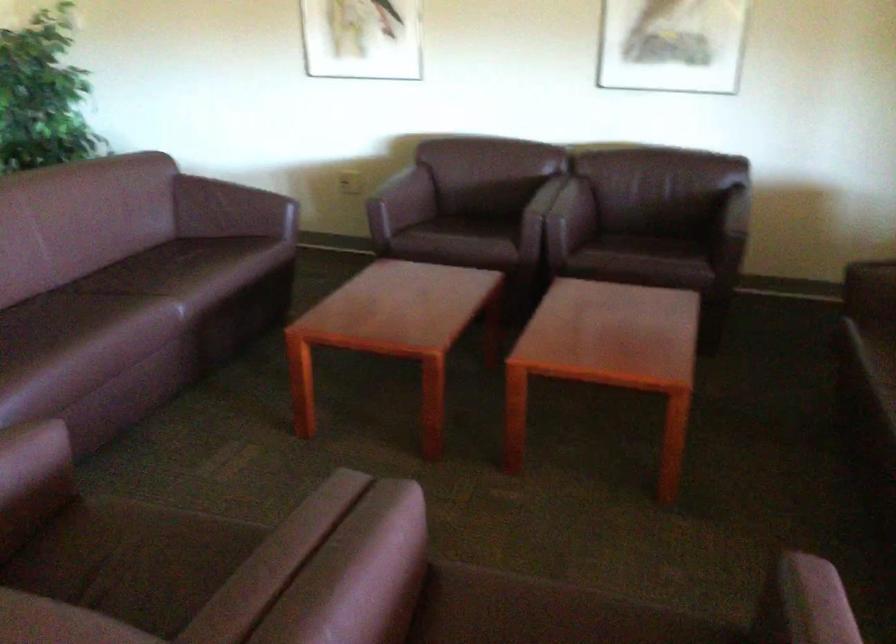
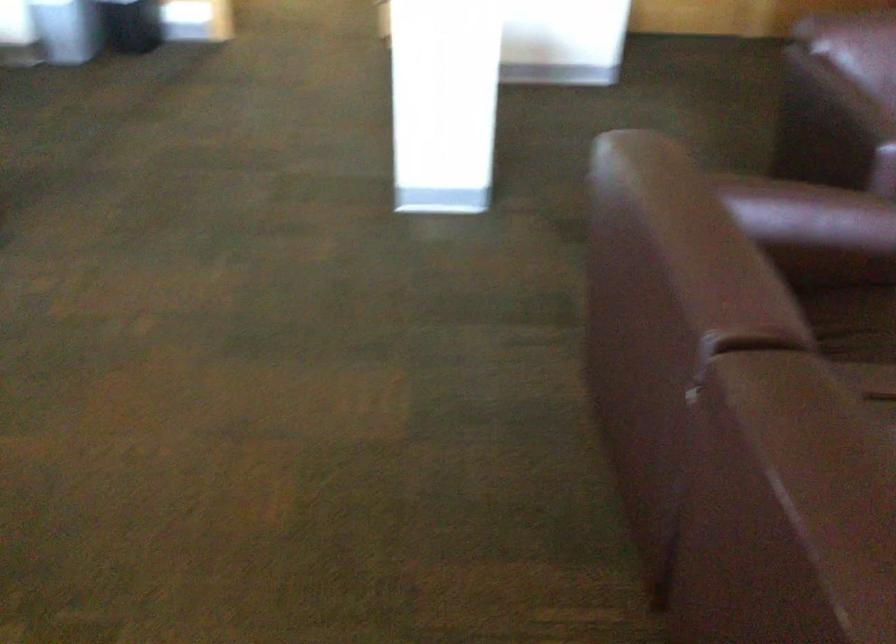
Based on the photo, the images are taken continuously from a first-person perspective. In which direction is your viewpoint rotating?

The rotation direction of the camera is left-down.